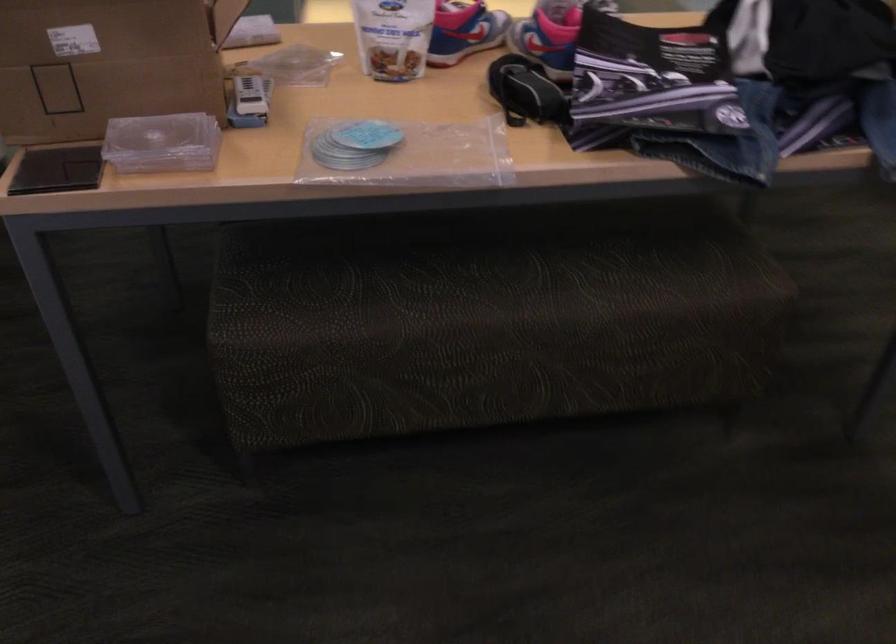
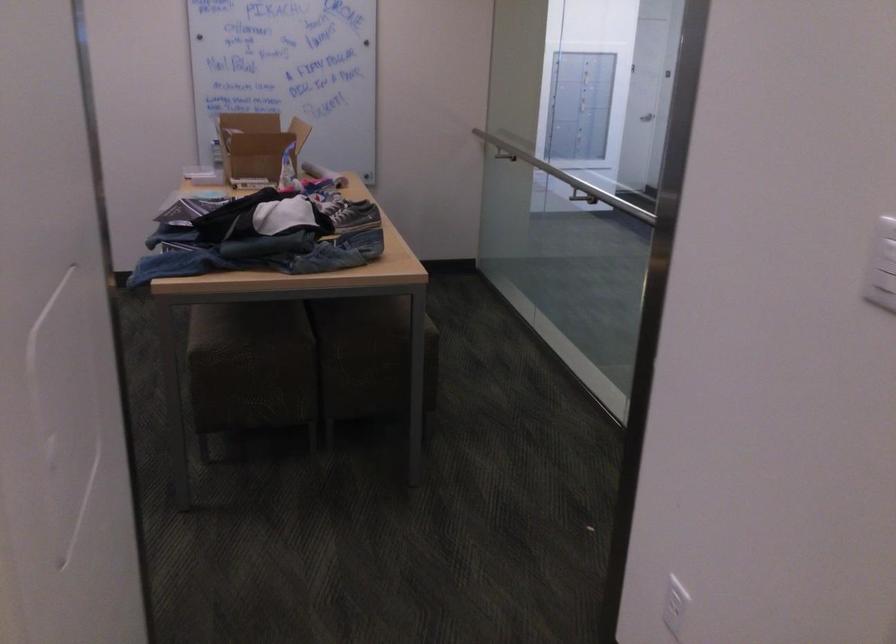
Question: I am providing you with two images of the same scene from different viewpoints. After the viewpoint changes to image2, which objects are now occluded?

Choices:
 (A) cardboard box
 (B) white electrical outlet
 (C) small toy truck
 (D) orange cylindrical object

Answer: (C)